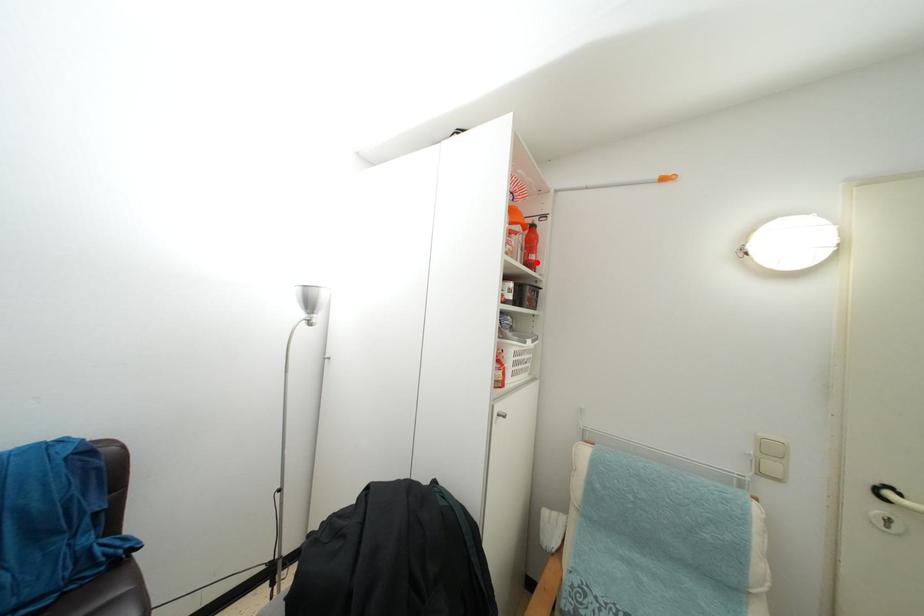
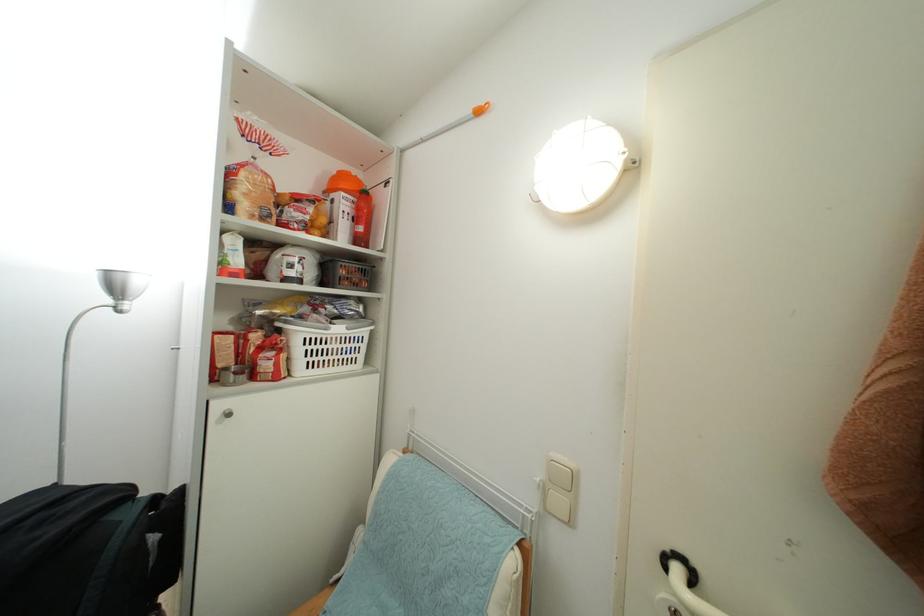
Where in the second image is the point corresponding to the highlighted location from the first image?

(365, 235)